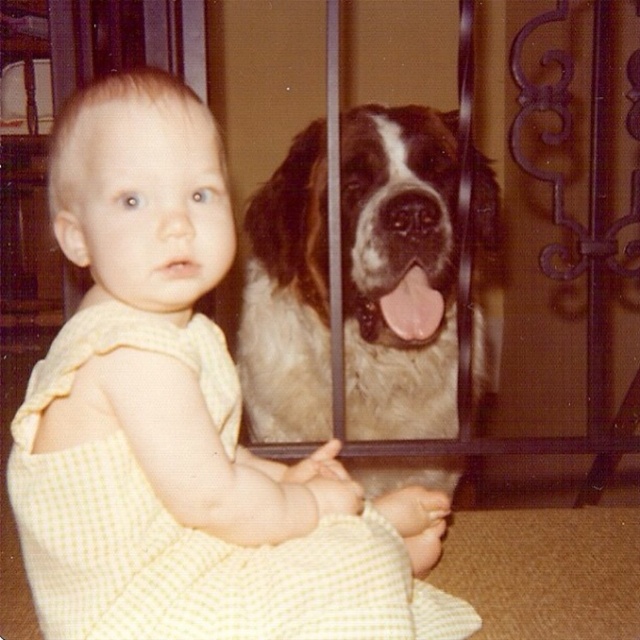
Between yellow checkered dress at center and fuzzy white dog at center, which one appears on the left side from the viewer's perspective?

yellow checkered dress at center

Does point (374, 540) come closer to viewer compared to point (342, 188)?

Yes, it is in front of point (342, 188).

Between point (308, 589) and point (420, 106), which one is positioned behind?

Point (420, 106)

The image size is (640, 640). What are the coordinates of `yellow checkered dress at center` in the screenshot? It's located at (189, 528).